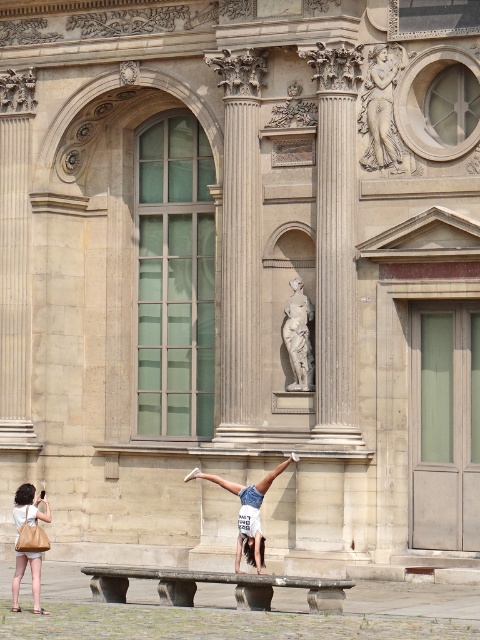
Consider the image. Who is lower down, white marble statue at center or matte beige handbag at lower left?

matte beige handbag at lower left is lower down.

Image resolution: width=480 pixels, height=640 pixels. What do you see at coordinates (299, 337) in the screenshot?
I see `white marble statue at center` at bounding box center [299, 337].

Identify the location of white marble statue at center. Image resolution: width=480 pixels, height=640 pixels. (x=299, y=337).

Identify the location of white marble statue at center. (299, 337).

Does denim shorts at center have a lesser width compared to white marble statue at center?

No, denim shorts at center is not thinner than white marble statue at center.

Is denim shorts at center below white marble statue at center?

Yes, denim shorts at center is below white marble statue at center.

Does point (252, 528) come in front of point (304, 330)?

Yes.

Locate an element on the screen. Image resolution: width=480 pixels, height=640 pixels. denim shorts at center is located at coordinates (248, 513).

Is polished stone relief at upper center positioned in front of matte beige handbag at lower left?

No, polished stone relief at upper center is behind matte beige handbag at lower left.

Where is `polished stone relief at upper center`? polished stone relief at upper center is located at coordinates click(381, 109).